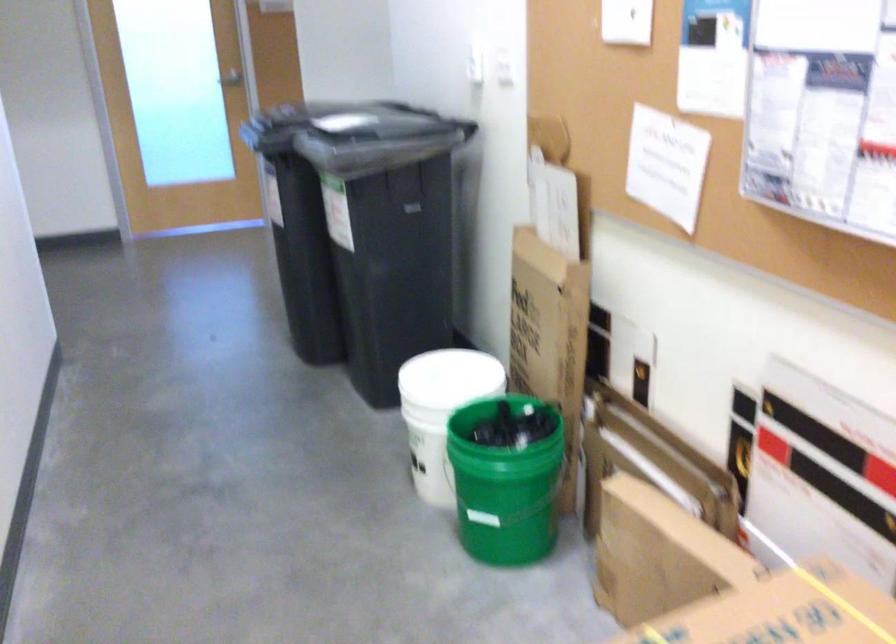
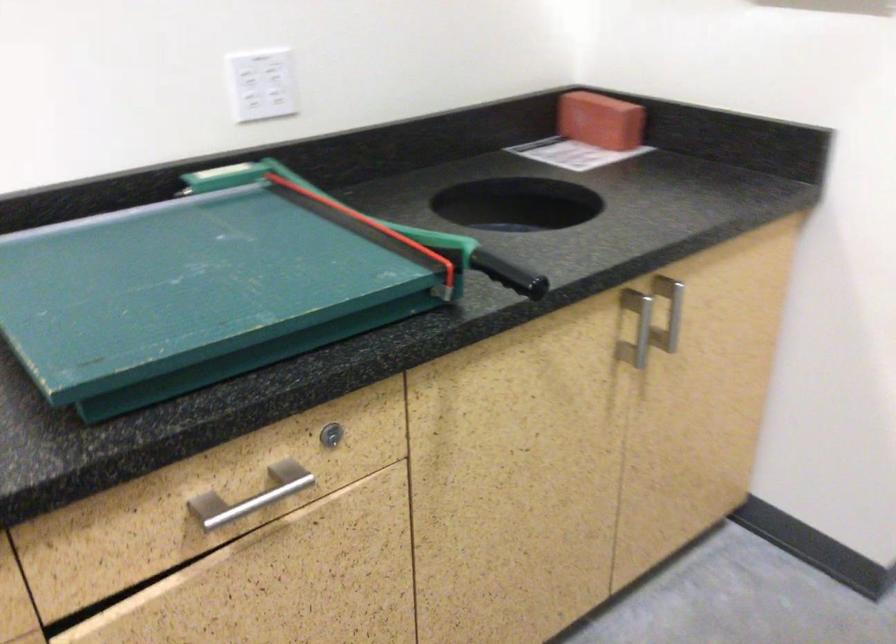
The first image is from the beginning of the video and the second image is from the end. How did the camera likely rotate when shooting the video?

The rotation direction of the camera is left-down.